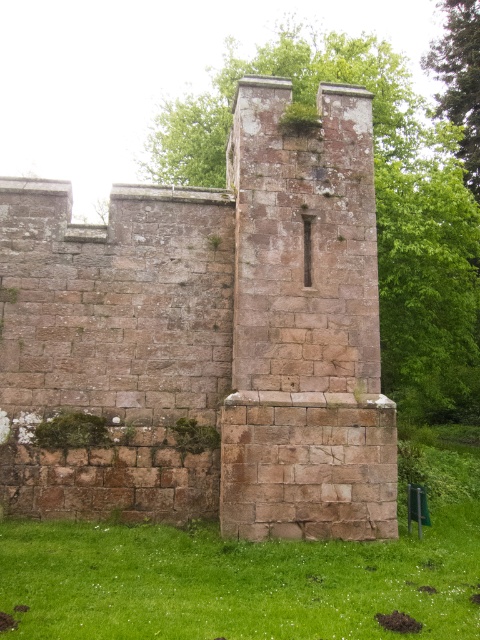
Question: From the image, what is the correct spatial relationship of rustic stone tower at center in relation to green grass at lower center?

Choices:
 (A) left
 (B) right

Answer: (A)

Question: Among these points, which one is farthest from the camera?

Choices:
 (A) (305, 410)
 (B) (211, 595)

Answer: (A)

Question: Which point is farther to the camera?

Choices:
 (A) rustic stone tower at center
 (B) green grass at lower center

Answer: (A)

Question: Is the position of rustic stone tower at center less distant than that of green grass at lower center?

Choices:
 (A) no
 (B) yes

Answer: (A)

Question: Is rustic stone tower at center thinner than green grass at lower center?

Choices:
 (A) no
 (B) yes

Answer: (B)